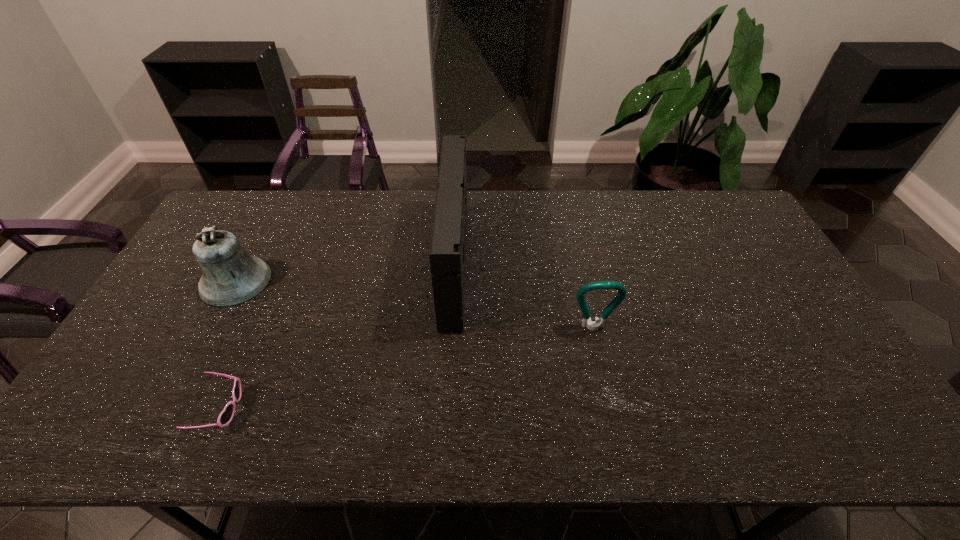
Find the location of a particular element. The height and width of the screenshot is (540, 960). the tallest object is located at coordinates (447, 255).

Find the location of a particular element. This screenshot has width=960, height=540. videotape is located at coordinates (447, 255).

You are a GUI agent. You are given a task and a screenshot of the screen. Output one action in this format:
    pyautogui.click(x=<x>, y=<y>)
    Task: Click on the bell
    The image size is (960, 540).
    Given the screenshot: What is the action you would take?
    pyautogui.click(x=231, y=277)

Locate an element on the screen. The height and width of the screenshot is (540, 960). the rightmost object is located at coordinates (594, 325).

Locate an element on the screen. The height and width of the screenshot is (540, 960). the nearest object is located at coordinates (226, 416).

Find the location of a particular element. the shortest object is located at coordinates (226, 416).

Where is `vacant space situated 0.240m on the side of the second object from right to left with visible spindles`? vacant space situated 0.240m on the side of the second object from right to left with visible spindles is located at coordinates pyautogui.click(x=542, y=265).

Find the location of a particular element. vacant region located 0.050m on the back of the bell is located at coordinates (253, 247).

Image resolution: width=960 pixels, height=540 pixels. I want to click on free space located at the jaws of the bottle opener, so click(x=612, y=414).

Identify the location of vacant area located on the front-facing side of the nearest object. This screenshot has width=960, height=540. (304, 409).